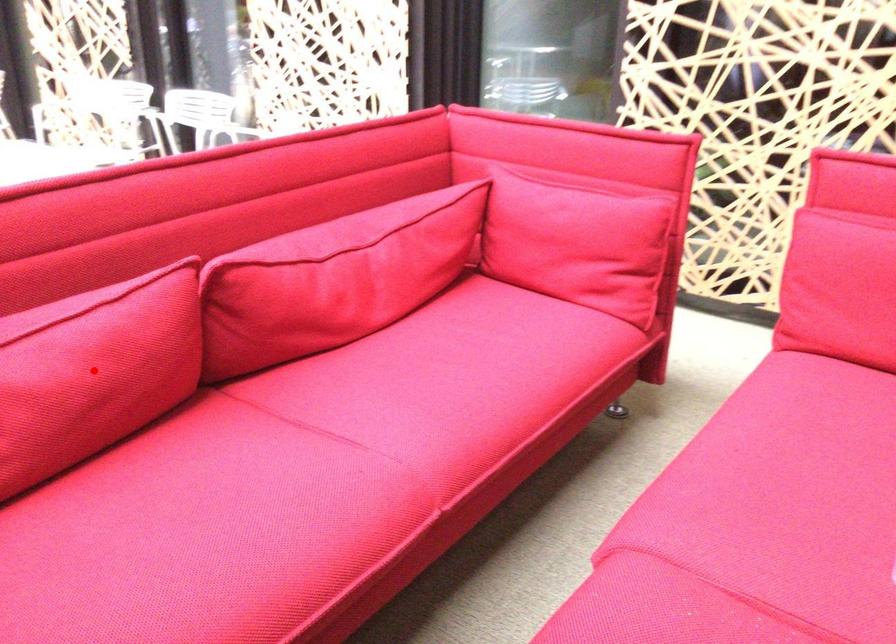
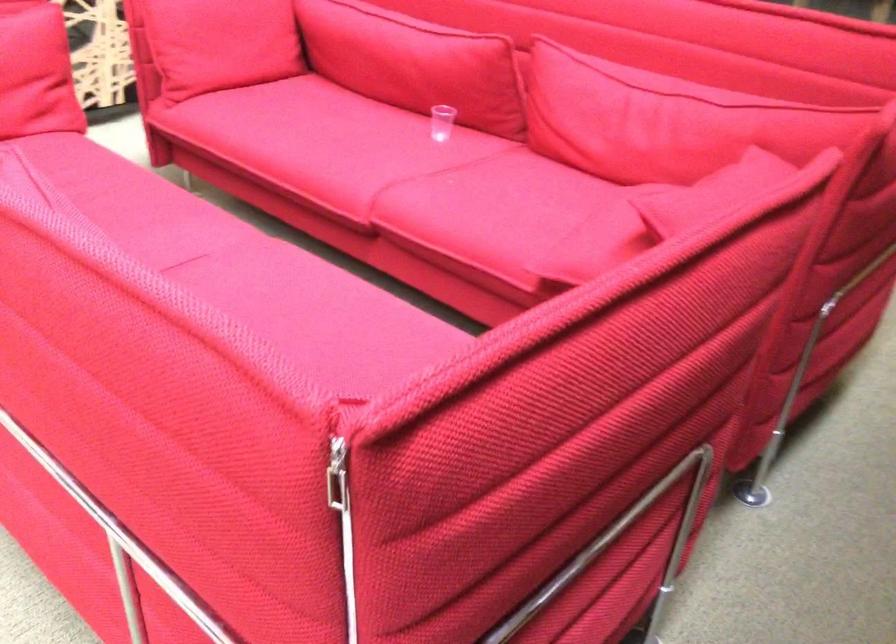
Question: I am providing you with two images of the same scene from different viewpoints. A red point is marked on the first image. Is the red point's position out of view in image 2?

Choices:
 (A) Yes
 (B) No

Answer: (A)